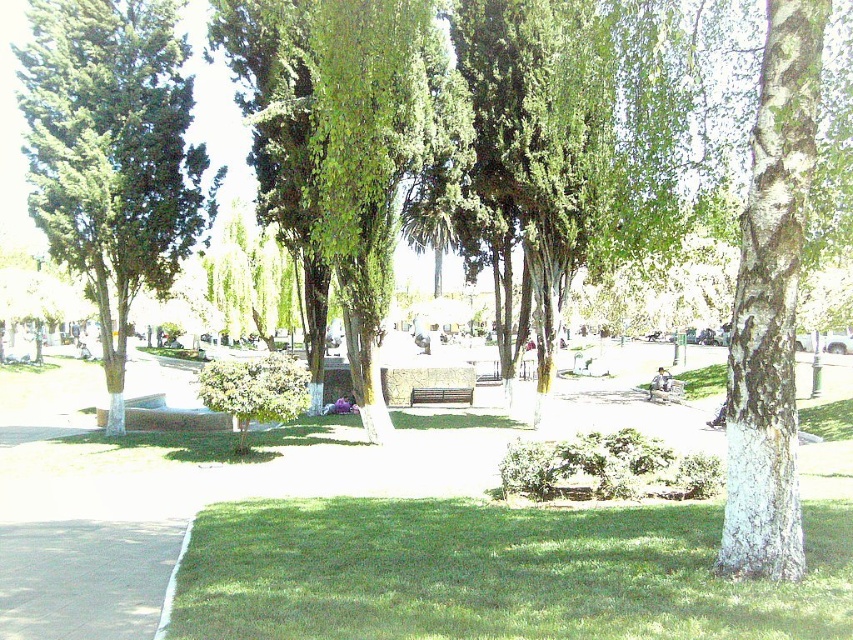
Question: Estimate the real-world distances between objects in this image. Which object is farther from the white bark tree at right?

Choices:
 (A) metallic silver bench at center
 (B) green grass at lower center
 (C) green leafy tree at left
 (D) wooden park bench at center

Answer: (D)

Question: Is green grass at lower center positioned before wooden park bench at center?

Choices:
 (A) yes
 (B) no

Answer: (A)

Question: Which object is positioned farthest from the green grass at lower center?

Choices:
 (A) wooden park bench at center
 (B) green leafy tree at left
 (C) metallic silver bench at center
 (D) white bark tree at right

Answer: (A)

Question: Is green leafy tree at left bigger than wooden park bench at center?

Choices:
 (A) no
 (B) yes

Answer: (B)

Question: Is green grass at lower center smaller than metallic silver bench at center?

Choices:
 (A) no
 (B) yes

Answer: (B)

Question: Which object appears closest to the camera in this image?

Choices:
 (A) green leafy tree at left
 (B) green grass at lower center
 (C) white bark tree at right
 (D) metallic silver bench at center

Answer: (B)